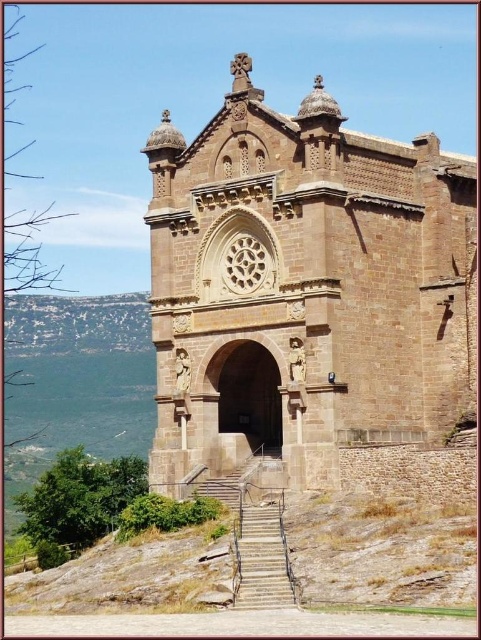
Question: Which of the following is the closest to the observer?

Choices:
 (A) brown stone church at center
 (B) stone textured stairs at center

Answer: (B)

Question: Is brown stone church at center above stone textured stairs at center?

Choices:
 (A) yes
 (B) no

Answer: (A)

Question: Is brown stone church at center in front of stone textured stairs at center?

Choices:
 (A) no
 (B) yes

Answer: (A)

Question: Does brown stone church at center have a smaller size compared to stone textured stairs at center?

Choices:
 (A) yes
 (B) no

Answer: (B)